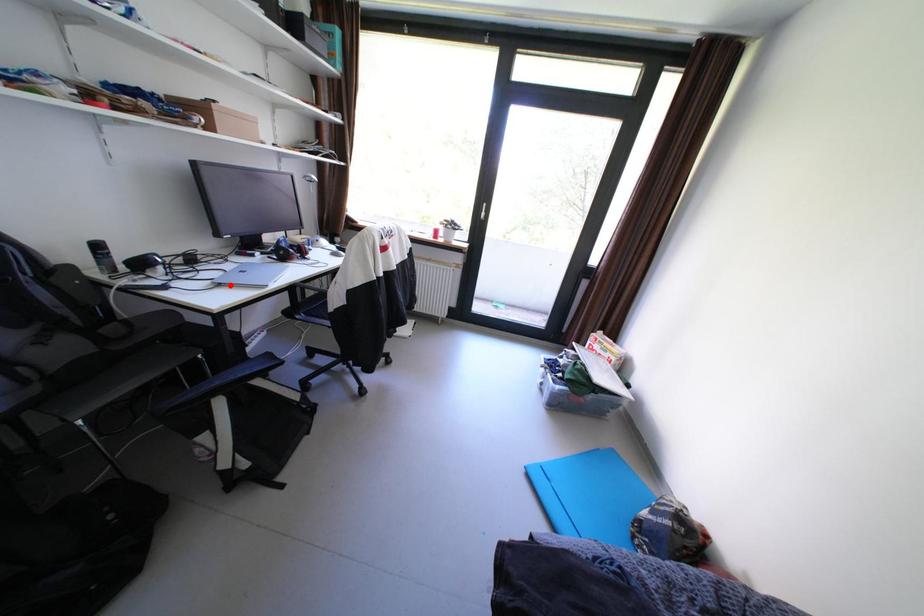
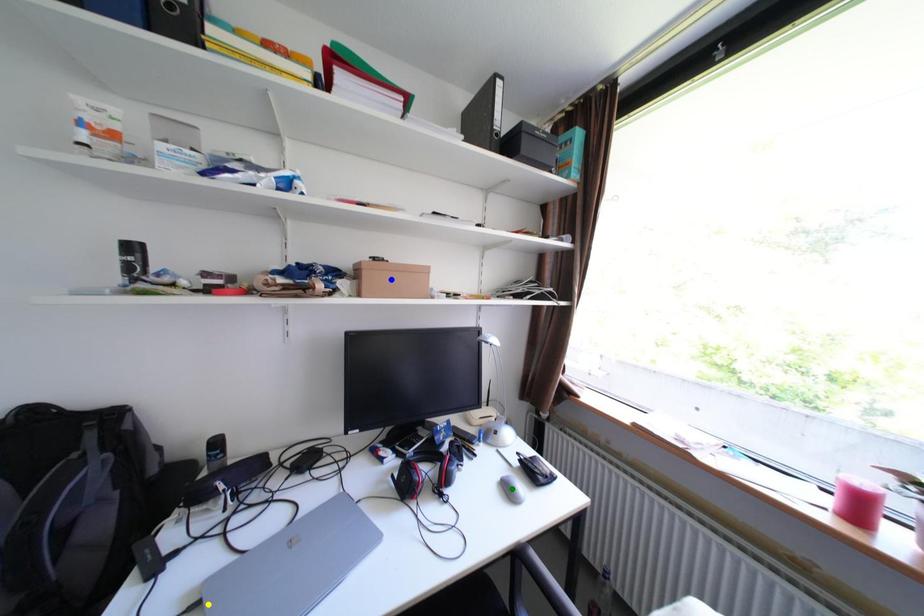
Question: I am providing you with two images of the same scene from different viewpoints. A red point is marked on the first image. You are given multiple points on the second image. In image 2, which mark is for the same physical point as the one in image 1?

Choices:
 (A) yellow point
 (B) green point
 (C) blue point

Answer: (A)